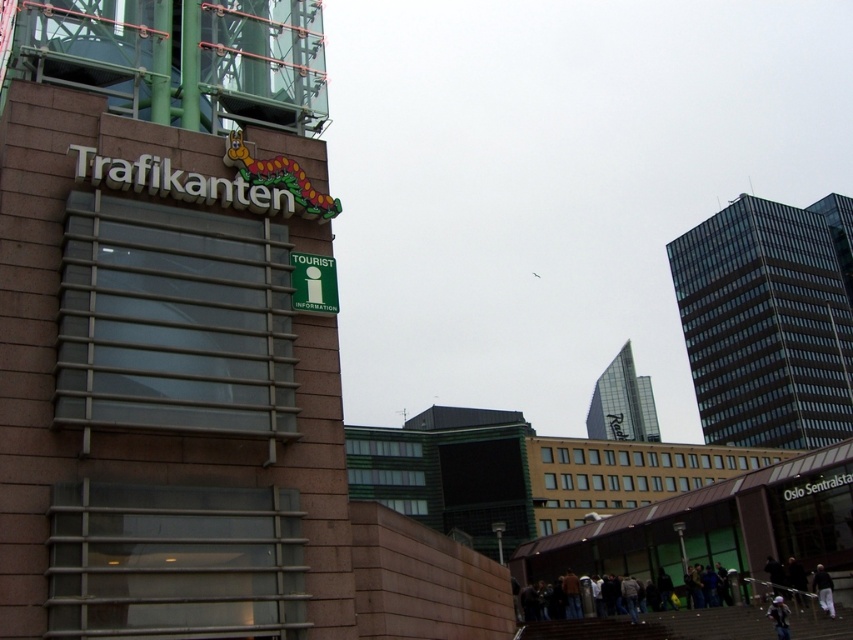
You are a city planner assessing the skyline. Given that the glassy black skyscraper at right is much taller than the glassy silver tower at upper right, which building would cast a longer shadow during midday? Please explain your reasoning based on their heights.

The glassy black skyscraper at right would cast a longer shadow than the glassy silver tower at upper right because it is much taller. Taller buildings generally cast longer shadows when the sun is at the same angle, assuming similar surrounding structures and ground conditions.

You are standing in front of the Trafikanten building and want to take a photo that includes both the Trafikanten building and the glassy black skyscraper at right. Since you have a camera with a 50mm lens, which has a standard field of view, can you fit both buildings in the frame without moving your position?

The glassy black skyscraper at right is 148.83 meters away from the camera. However, without knowing the distance to the Trafikanten building or the angle of view required to include both, it is impossible to determine if they can both fit in the frame with a 50mm lens. Additional information about their positions relative to each other and the camera is needed.